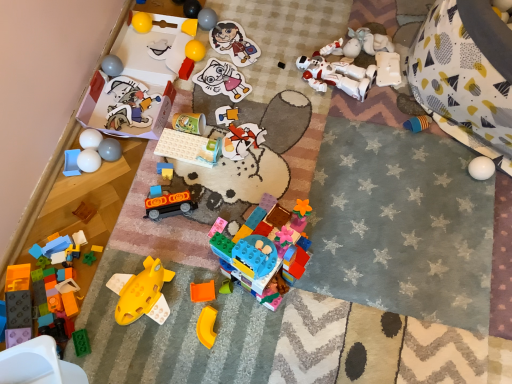
Where is `free point to the left of translucent orange plastic at center, arranged as the nineteenth toy when viewed from the left`? free point to the left of translucent orange plastic at center, arranged as the nineteenth toy when viewed from the left is located at coordinates (169, 295).